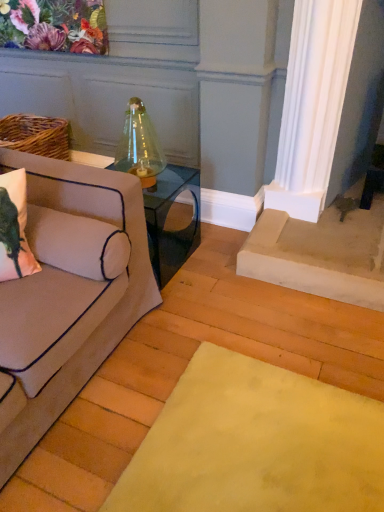
Question: Can you confirm if matte pink pillow at left is taller than clear glass table at center?

Choices:
 (A) no
 (B) yes

Answer: (A)

Question: Can you confirm if matte pink pillow at left is smaller than clear glass table at center?

Choices:
 (A) yes
 (B) no

Answer: (A)

Question: Can you confirm if matte pink pillow at left is wider than clear glass table at center?

Choices:
 (A) yes
 (B) no

Answer: (B)

Question: Can you confirm if matte pink pillow at left is bigger than clear glass table at center?

Choices:
 (A) yes
 (B) no

Answer: (B)

Question: Is matte pink pillow at left looking in the opposite direction of clear glass table at center?

Choices:
 (A) no
 (B) yes

Answer: (A)

Question: Is matte pink pillow at left wider or thinner than clear glass table at center?

Choices:
 (A) thin
 (B) wide

Answer: (A)

Question: In terms of height, does matte pink pillow at left look taller or shorter compared to clear glass table at center?

Choices:
 (A) short
 (B) tall

Answer: (A)

Question: From the image's perspective, is matte pink pillow at left located above or below clear glass table at center?

Choices:
 (A) above
 (B) below

Answer: (B)

Question: Choose the correct answer: Is matte pink pillow at left inside clear glass table at center or outside it?

Choices:
 (A) outside
 (B) inside

Answer: (A)

Question: Based on their sizes in the image, would you say clear glass table at center is bigger or smaller than matte pink pillow at left?

Choices:
 (A) small
 (B) big

Answer: (B)

Question: Based on their positions, is clear glass table at center located to the left or right of matte pink pillow at left?

Choices:
 (A) right
 (B) left

Answer: (A)

Question: From a real-world perspective, is clear glass table at center positioned above or below matte pink pillow at left?

Choices:
 (A) below
 (B) above

Answer: (A)

Question: In the image, is clear glass table at center positioned in front of or behind matte pink pillow at left?

Choices:
 (A) front
 (B) behind

Answer: (B)

Question: Is beige fabric couch at left in front of or behind clear glass table at center in the image?

Choices:
 (A) front
 (B) behind

Answer: (A)

Question: Is beige fabric couch at left inside the boundaries of clear glass table at center, or outside?

Choices:
 (A) inside
 (B) outside

Answer: (B)